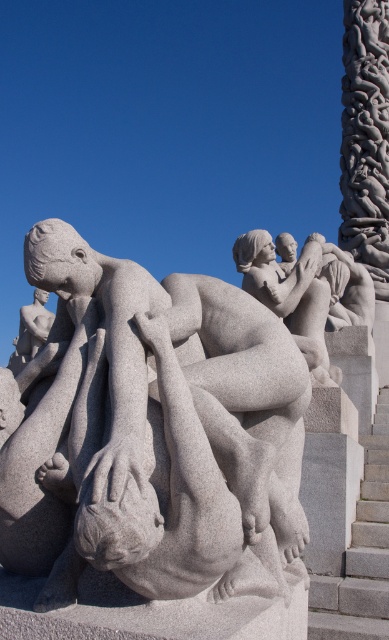
Who is shorter, gray granite sculpture at center or gray stone stairs at right?

gray stone stairs at right is shorter.

Who is lower down, gray granite sculpture at center or gray stone stairs at right?

Positioned lower is gray stone stairs at right.

Which is in front, point (145, 308) or point (317, 612)?

Point (145, 308)

Where is `gray granite sculpture at center`? The width and height of the screenshot is (389, 640). gray granite sculpture at center is located at coordinates (155, 435).